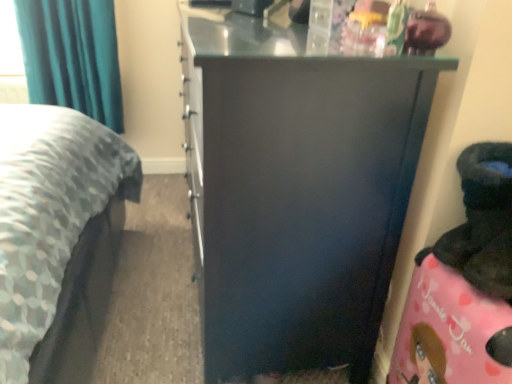
Question: Is matte black cabinet at center located outside teal fabric curtain at upper left?

Choices:
 (A) no
 (B) yes

Answer: (B)

Question: Is matte black cabinet at center wider than teal fabric curtain at upper left?

Choices:
 (A) no
 (B) yes

Answer: (B)

Question: Is matte black cabinet at center positioned far away from teal fabric curtain at upper left?

Choices:
 (A) yes
 (B) no

Answer: (A)

Question: From a real-world perspective, does matte black cabinet at center sit lower than teal fabric curtain at upper left?

Choices:
 (A) no
 (B) yes

Answer: (B)

Question: Is matte black cabinet at center smaller than teal fabric curtain at upper left?

Choices:
 (A) yes
 (B) no

Answer: (B)

Question: Is matte black cabinet at center placed right next to teal fabric curtain at upper left?

Choices:
 (A) yes
 (B) no

Answer: (B)

Question: Can you confirm if teal fabric curtain at upper left is shorter than matte black cabinet at center?

Choices:
 (A) no
 (B) yes

Answer: (B)

Question: From the image's perspective, is teal fabric curtain at upper left below matte black cabinet at center?

Choices:
 (A) no
 (B) yes

Answer: (A)

Question: Is teal fabric curtain at upper left turned away from matte black cabinet at center?

Choices:
 (A) yes
 (B) no

Answer: (B)

Question: Would you say teal fabric curtain at upper left is a long distance from matte black cabinet at center?

Choices:
 (A) yes
 (B) no

Answer: (A)

Question: Is teal fabric curtain at upper left taller than matte black cabinet at center?

Choices:
 (A) yes
 (B) no

Answer: (B)

Question: Is teal fabric curtain at upper left in front of matte black cabinet at center?

Choices:
 (A) yes
 (B) no

Answer: (B)

Question: Would you say teal fabric curtain at upper left is to the left or to the right of matte black cabinet at center in the picture?

Choices:
 (A) left
 (B) right

Answer: (A)